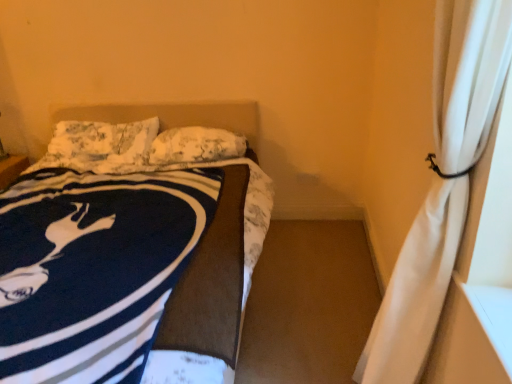
Question: Would you say fluffy white pillow at upper left, which is the second pillow from right to left, is part of navy blue fleece blanket at left's contents?

Choices:
 (A) no
 (B) yes

Answer: (B)

Question: Is navy blue fleece blanket at left further to camera compared to fluffy white pillow at upper left, which is the second pillow from right to left?

Choices:
 (A) yes
 (B) no

Answer: (B)

Question: Is fluffy white pillow at upper left, which is the 1th pillow in left-to-right order, at the back of navy blue fleece blanket at left?

Choices:
 (A) no
 (B) yes

Answer: (B)

Question: Is navy blue fleece blanket at left next to fluffy white pillow at upper left, which is the second pillow from right to left?

Choices:
 (A) no
 (B) yes

Answer: (A)

Question: From the image's perspective, is navy blue fleece blanket at left over fluffy white pillow at upper left, which is the second pillow from right to left?

Choices:
 (A) yes
 (B) no

Answer: (B)

Question: Is navy blue fleece blanket at left facing towards fluffy white pillow at upper left, which is the second pillow from right to left?

Choices:
 (A) yes
 (B) no

Answer: (B)

Question: Is white sheer curtain at right positioned far away from white textured pillow at center, which appears as the 2th pillow when viewed from the left?

Choices:
 (A) no
 (B) yes

Answer: (B)

Question: Is white sheer curtain at right outside white textured pillow at center, which appears as the 2th pillow when viewed from the left?

Choices:
 (A) yes
 (B) no

Answer: (A)

Question: From a real-world perspective, is white sheer curtain at right physically above white textured pillow at center, which appears as the 2th pillow when viewed from the left?

Choices:
 (A) no
 (B) yes

Answer: (B)

Question: From the image's perspective, is white sheer curtain at right below white textured pillow at center, which appears as the 2th pillow when viewed from the left?

Choices:
 (A) no
 (B) yes

Answer: (B)

Question: Is white textured pillow at center, placed as the 1th pillow when sorted from right to left, inside white sheer curtain at right?

Choices:
 (A) no
 (B) yes

Answer: (A)

Question: Is the depth of white sheer curtain at right greater than that of white textured pillow at center, which appears as the 2th pillow when viewed from the left?

Choices:
 (A) no
 (B) yes

Answer: (A)

Question: From the image's perspective, is white sheer curtain at right located above fluffy white pillow at upper left, which is the second pillow from right to left?

Choices:
 (A) yes
 (B) no

Answer: (B)